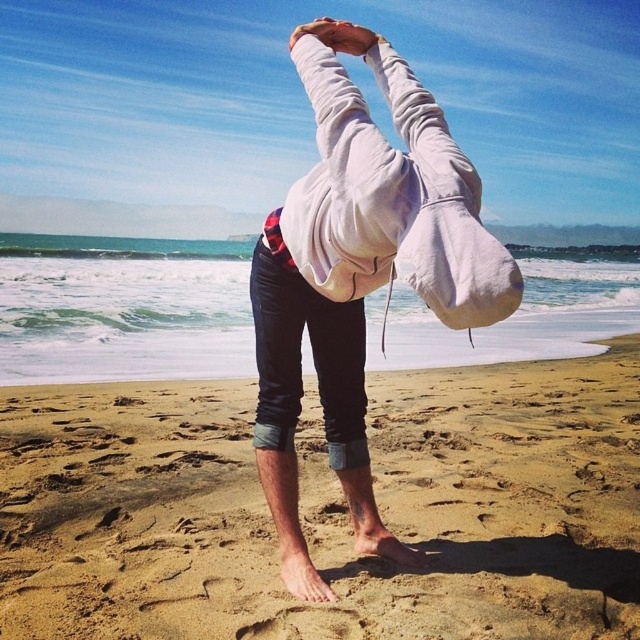
Who is positioned more to the right, sandy yellow sand at lower center or gray fleece hoodie at center?

Positioned to the right is sandy yellow sand at lower center.

Measure the distance from sandy yellow sand at lower center to gray fleece hoodie at center.

sandy yellow sand at lower center is 6.91 feet away from gray fleece hoodie at center.

Which is in front, point (560, 506) or point (349, 396)?

Point (349, 396)

The width and height of the screenshot is (640, 640). I want to click on sandy yellow sand at lower center, so click(x=326, y=509).